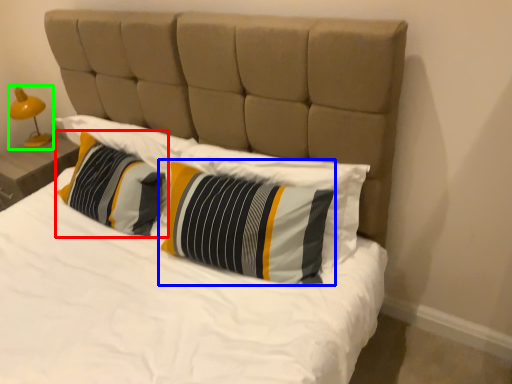
Question: Based on their relative distances, which object is nearer to pillow (highlighted by a red box)? Choose from pillow (highlighted by a blue box) and bedside lamp (highlighted by a green box).

Choices:
 (A) pillow
 (B) bedside lamp

Answer: (A)